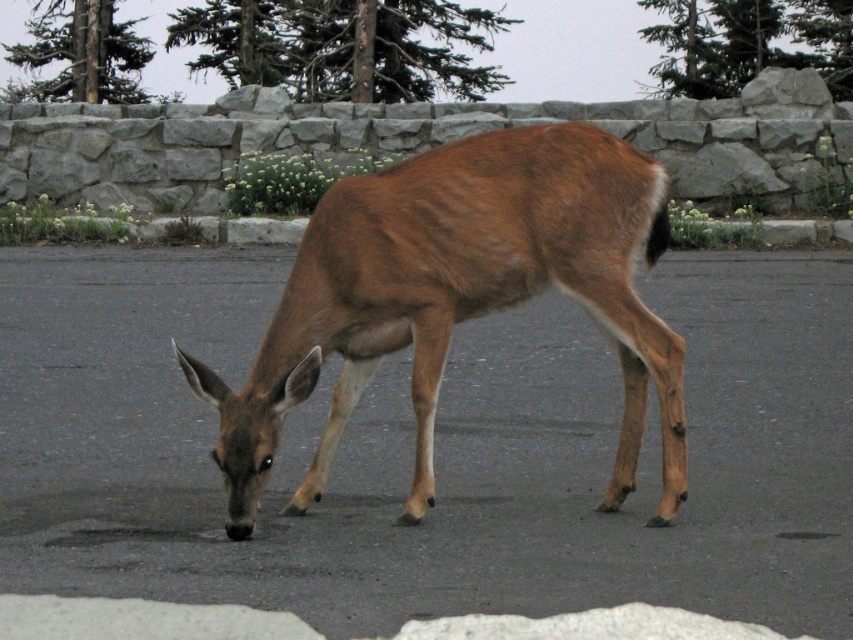
Question: Considering the relative positions of brown fur deer at center and brown furry deer at center in the image provided, where is brown fur deer at center located with respect to brown furry deer at center?

Choices:
 (A) right
 (B) left

Answer: (A)

Question: Is brown fur deer at center below brown furry deer at center?

Choices:
 (A) no
 (B) yes

Answer: (A)

Question: Is brown fur deer at center to the right of brown furry deer at center from the viewer's perspective?

Choices:
 (A) yes
 (B) no

Answer: (A)

Question: Which point is closer to the camera?

Choices:
 (A) brown furry deer at center
 (B) brown fur deer at center

Answer: (B)

Question: Which object appears farthest from the camera in this image?

Choices:
 (A) brown fur deer at center
 (B) brown furry deer at center

Answer: (B)